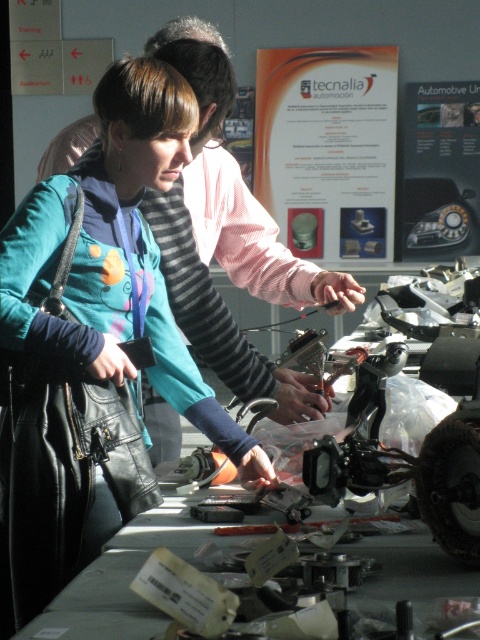
You are organizing a tool display at the exhibition and need to place the teal fabric jacket at center and metallic gray tools at center on a shelf. Given their widths, which item should you place first to ensure they both fit on the shelf?

Since the teal fabric jacket at center is narrower than the metallic gray tools at center, you should place the metallic gray tools at center first to accommodate their larger width before fitting the teal fabric jacket at center alongside them.

You are an attendee at the exhibition and want to determine which item is higher between the teal fabric jacket at center and the metallic gray tools at center. Based on the scene description, which one is taller?

The teal fabric jacket at center is taller than the metallic gray tools at center according to the description.